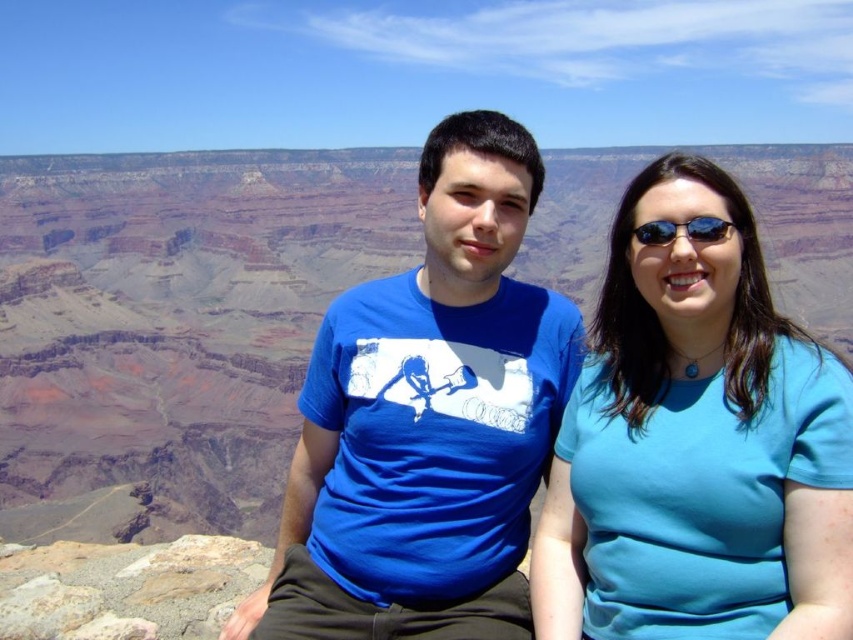
Can you confirm if blue cotton t-shirt at center is thinner than sunglasses at upper right?

In fact, blue cotton t-shirt at center might be wider than sunglasses at upper right.

What do you see at coordinates (427, 419) in the screenshot?
I see `blue cotton t-shirt at center` at bounding box center [427, 419].

Locate an element on the screen. This screenshot has width=853, height=640. blue cotton t-shirt at center is located at coordinates (427, 419).

Consider the image. Who is shorter, blue fabric shirt at center or blue cotton t-shirt at center?

Standing shorter between the two is blue fabric shirt at center.

Does point (675, 509) lie in front of point (459, 579)?

Yes, point (675, 509) is in front of point (459, 579).

Identify the location of blue fabric shirt at center. The height and width of the screenshot is (640, 853). (697, 444).

Where is `blue fabric shirt at center`? This screenshot has height=640, width=853. blue fabric shirt at center is located at coordinates (697, 444).

Can you confirm if blue fabric shirt at center is shorter than sunglasses at upper right?

No, blue fabric shirt at center is not shorter than sunglasses at upper right.

Which of these two, blue fabric shirt at center or sunglasses at upper right, stands taller?

blue fabric shirt at center is taller.

Locate an element on the screen. blue fabric shirt at center is located at coordinates (697, 444).

Where is `blue fabric shirt at center`? Image resolution: width=853 pixels, height=640 pixels. blue fabric shirt at center is located at coordinates (697, 444).